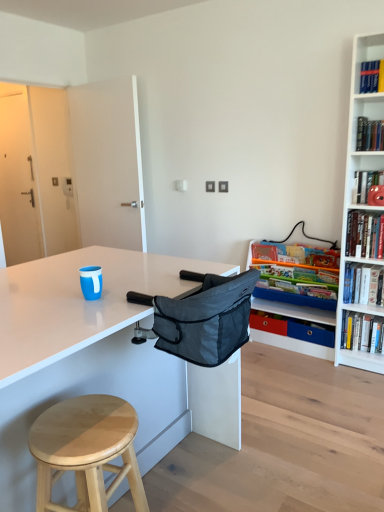
Locate an element on the screen. vacant point above light wood stool at lower left (from a real-world perspective) is located at coordinates (84, 421).